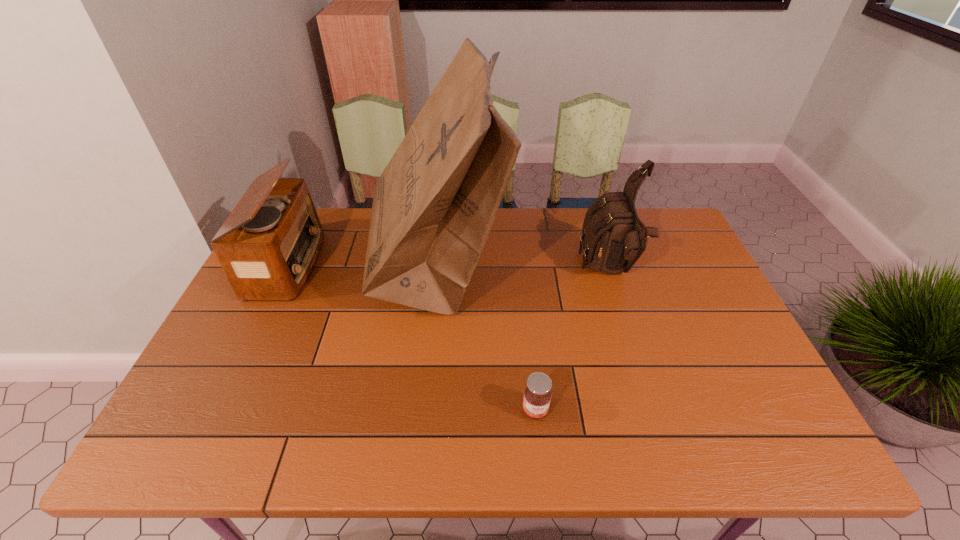
I want to click on vacant space situated 0.050m on the front panel of the radio receiver, so click(x=333, y=264).

Identify the location of grocery bag at the far edge. This screenshot has width=960, height=540. (434, 205).

Where is `shoulder bag that is at the far edge`? Image resolution: width=960 pixels, height=540 pixels. shoulder bag that is at the far edge is located at coordinates (613, 237).

Locate an element on the screen. This screenshot has width=960, height=540. radio receiver that is at the far edge is located at coordinates (269, 244).

Locate an element on the screen. The image size is (960, 540). object that is positioned at the near edge is located at coordinates (537, 395).

Where is `object that is at the left edge`? object that is at the left edge is located at coordinates (269, 244).

This screenshot has width=960, height=540. In order to click on object that is at the far left corner in this screenshot , I will do `click(269, 244)`.

The image size is (960, 540). In the image, there is a desktop. In order to click on blank space at the far edge in this screenshot , I will do 533,219.

Where is `vacant space at the near edge of the desktop`? The height and width of the screenshot is (540, 960). vacant space at the near edge of the desktop is located at coordinates (322, 446).

At what (x,y) coordinates should I click in order to perform the action: click on vacant area at the left edge. Please return your answer as a coordinate pair (x, y). Looking at the image, I should click on (253, 306).